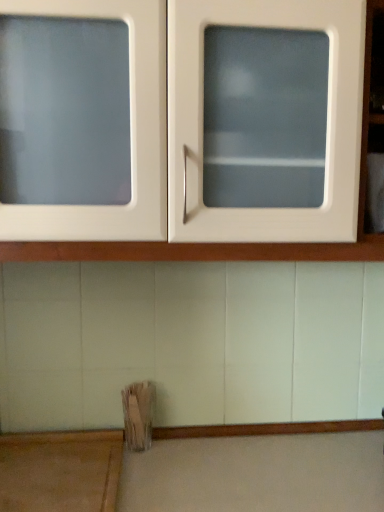
Question: Is wooden at lower left shorter than white glossy cabinet at upper center?

Choices:
 (A) yes
 (B) no

Answer: (A)

Question: From the image's perspective, would you say wooden at lower left is positioned over white glossy cabinet at upper center?

Choices:
 (A) no
 (B) yes

Answer: (A)

Question: Is wooden at lower left touching white glossy cabinet at upper center?

Choices:
 (A) yes
 (B) no

Answer: (B)

Question: Would you say white glossy cabinet at upper center is part of wooden at lower left's contents?

Choices:
 (A) no
 (B) yes

Answer: (A)

Question: Can you confirm if wooden at lower left is positioned to the left of white glossy cabinet at upper center?

Choices:
 (A) yes
 (B) no

Answer: (A)

Question: Is wooden at lower left wider than white glossy cabinet at upper center?

Choices:
 (A) yes
 (B) no

Answer: (B)

Question: Is white glossy cabinet at upper center not near wooden at lower left?

Choices:
 (A) yes
 (B) no

Answer: (B)

Question: Considering the relative sizes of white glossy cabinet at upper center and wooden at lower left in the image provided, is white glossy cabinet at upper center shorter than wooden at lower left?

Choices:
 (A) no
 (B) yes

Answer: (A)

Question: Is white glossy cabinet at upper center closer to the viewer compared to wooden at lower left?

Choices:
 (A) yes
 (B) no

Answer: (A)

Question: Is white glossy cabinet at upper center touching wooden at lower left?

Choices:
 (A) no
 (B) yes

Answer: (A)

Question: From the image's perspective, is white glossy cabinet at upper center under wooden at lower left?

Choices:
 (A) no
 (B) yes

Answer: (A)

Question: Is white glossy cabinet at upper center looking in the opposite direction of wooden at lower left?

Choices:
 (A) yes
 (B) no

Answer: (B)

Question: From the image's perspective, is wooden at lower left located above or below white glossy cabinet at upper center?

Choices:
 (A) above
 (B) below

Answer: (B)